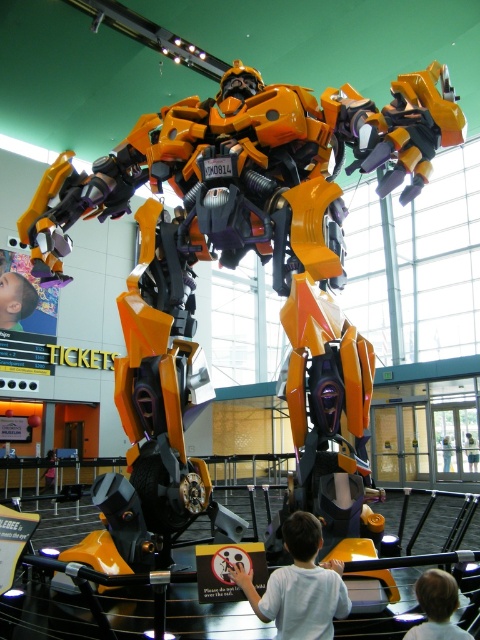
Question: Which point is farther to the camera?

Choices:
 (A) smooth skin child at lower right
 (B) white matte shirt at lower center

Answer: (B)

Question: Does white matte shirt at lower center have a greater width compared to smooth skin child at lower right?

Choices:
 (A) yes
 (B) no

Answer: (A)

Question: Which object is closer to the camera taking this photo?

Choices:
 (A) white matte shirt at lower center
 (B) smooth skin child at lower right

Answer: (B)

Question: Can you confirm if white matte shirt at lower center is wider than smooth skin child at lower right?

Choices:
 (A) yes
 (B) no

Answer: (A)

Question: Which object is farther from the camera taking this photo?

Choices:
 (A) white matte shirt at lower center
 (B) smooth skin child at lower right

Answer: (A)

Question: Does white matte shirt at lower center appear on the left side of smooth skin child at lower right?

Choices:
 (A) yes
 (B) no

Answer: (A)